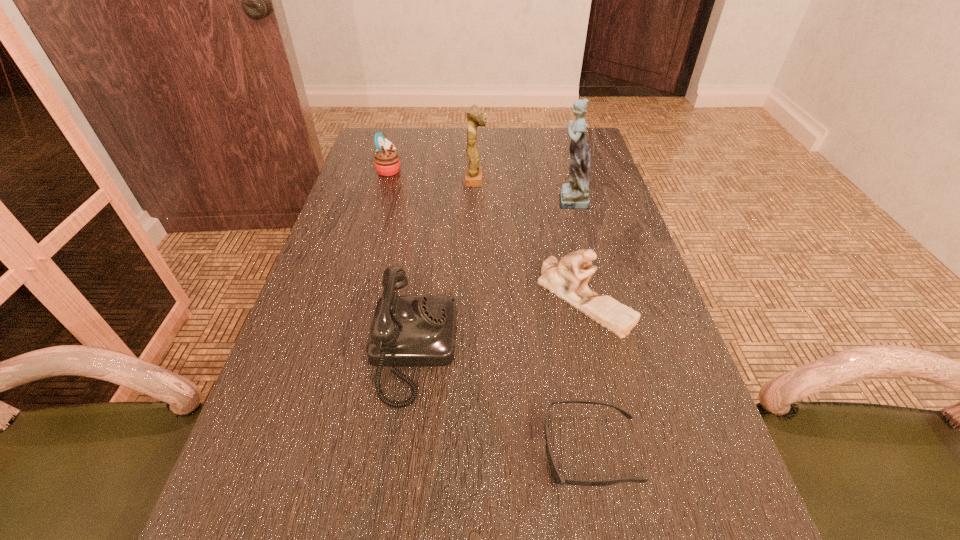
Where is `the tallest object`? This screenshot has height=540, width=960. the tallest object is located at coordinates (574, 195).

Locate an element on the screen. The image size is (960, 540). the fourth nearest object is located at coordinates (574, 195).

You are a GUI agent. You are given a task and a screenshot of the screen. Output one action in this format:
    pyautogui.click(x=<x>, y=<y>)
    Task: Click on the second tallest object
    This screenshot has height=540, width=960.
    Given the screenshot: What is the action you would take?
    pyautogui.click(x=473, y=174)

Where is `the farthest figurine`? This screenshot has height=540, width=960. the farthest figurine is located at coordinates (473, 174).

You are a GUI agent. You are given a task and a screenshot of the screen. Output one action in this format:
    pyautogui.click(x=<x>, y=<y>)
    Task: Click on the nearest figurine
    This screenshot has height=540, width=960.
    Given the screenshot: What is the action you would take?
    pyautogui.click(x=562, y=278)

Identify the location of telephone. (407, 330).

Identify the location of muffin. This screenshot has height=540, width=960. (386, 160).

The width and height of the screenshot is (960, 540). What are the coordinates of `the nearest object` in the screenshot? It's located at (558, 479).

You are a GUI agent. You are given a task and a screenshot of the screen. Output one action in this format:
    pyautogui.click(x=<x>, y=<y>)
    Task: Click on the sunglasses
    
    Given the screenshot: What is the action you would take?
    pyautogui.click(x=558, y=479)

Locate an element on the screen. vacant space located on the front-facing side of the tallest object is located at coordinates (512, 199).